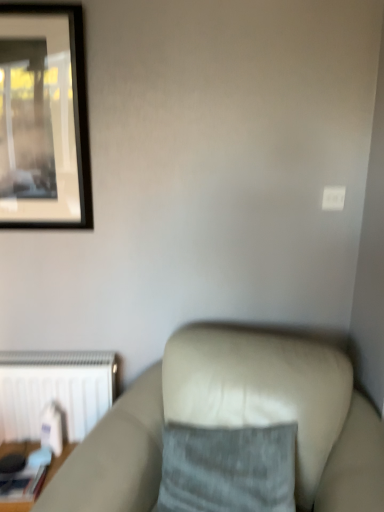
Question: From the image's perspective, relative to white matte radiator at lower left, is gray fabric pillow at center above or below?

Choices:
 (A) below
 (B) above

Answer: (A)

Question: Based on their sizes in the image, would you say gray fabric pillow at center is bigger or smaller than white matte radiator at lower left?

Choices:
 (A) big
 (B) small

Answer: (A)

Question: Which object is the closest to the wooden table at lower left?

Choices:
 (A) suede-like beige couch at lower right
 (B) gray fabric pillow at center
 (C) white matte radiator at lower left

Answer: (C)

Question: Based on their relative distances, which object is farther from the gray fabric pillow at center?

Choices:
 (A) suede-like beige couch at lower right
 (B) white matte radiator at lower left
 (C) wooden table at lower left

Answer: (B)